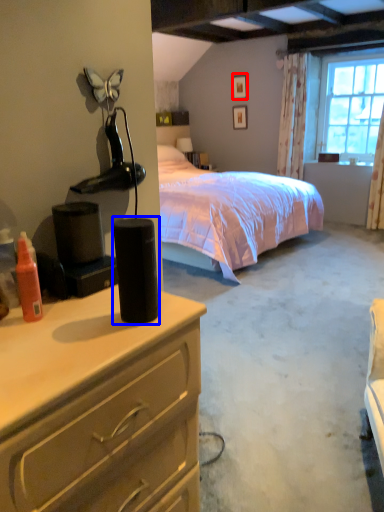
Question: Which object appears farthest to the camera in this image, picture frame (highlighted by a red box) or speaker (highlighted by a blue box)?

Choices:
 (A) picture frame
 (B) speaker

Answer: (A)